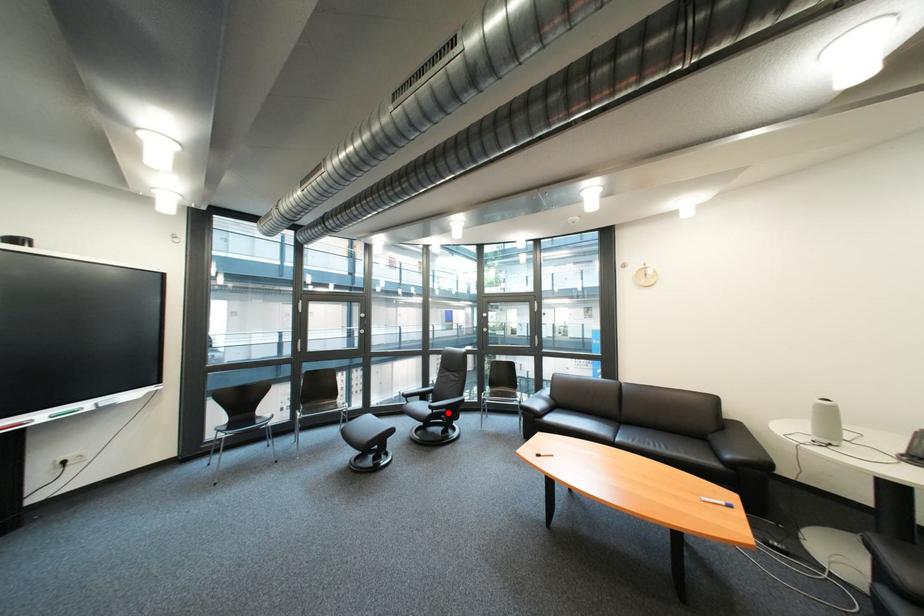
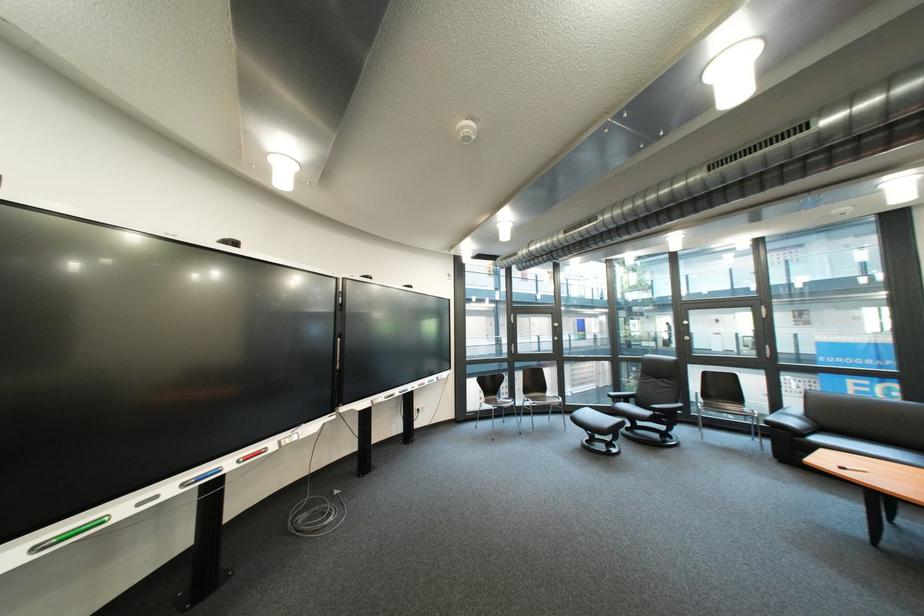
Question: A red point is marked in image1. In image2, is the corresponding 3D point closer to the camera or farther? Reply with the corresponding letter.

Choices:
 (A) The corresponding 3D point is closer.
 (B) The corresponding 3D point is farther.

Answer: (A)